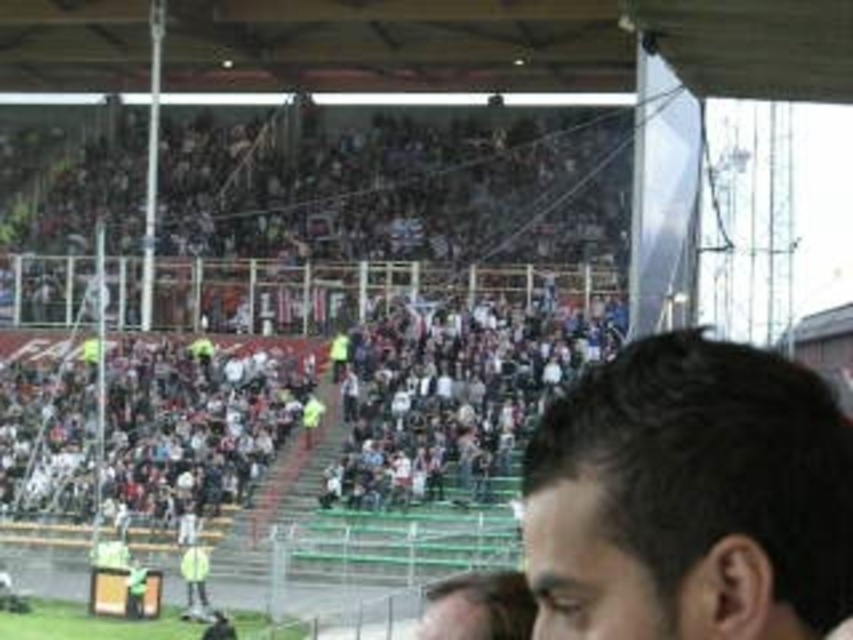
Question: From the image, what is the correct spatial relationship of multicolored fabric crowd at upper center in relation to dark brown hair at lower right?

Choices:
 (A) below
 (B) above

Answer: (B)

Question: Among these objects, which one is nearest to the camera?

Choices:
 (A) multicolored fabric crowd at upper center
 (B) dark brown hair at lower right

Answer: (B)

Question: Can you confirm if multicolored fabric crowd at upper center is positioned below dark brown hair at lower right?

Choices:
 (A) no
 (B) yes

Answer: (A)

Question: Which point appears closest to the camera in this image?

Choices:
 (A) (444, 346)
 (B) (676, 397)

Answer: (B)

Question: Does multicolored fabric crowd at upper center lie behind dark brown hair at lower right?

Choices:
 (A) yes
 (B) no

Answer: (A)